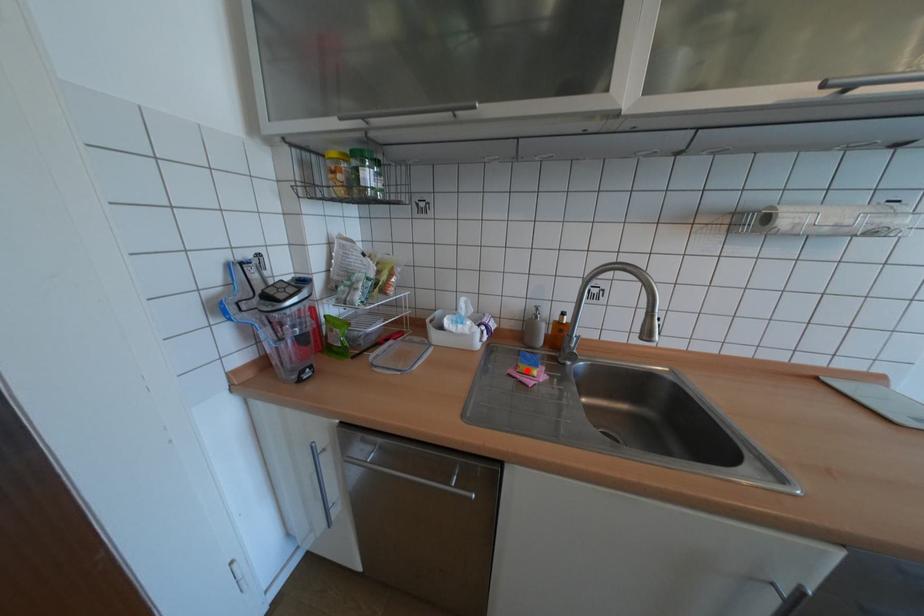
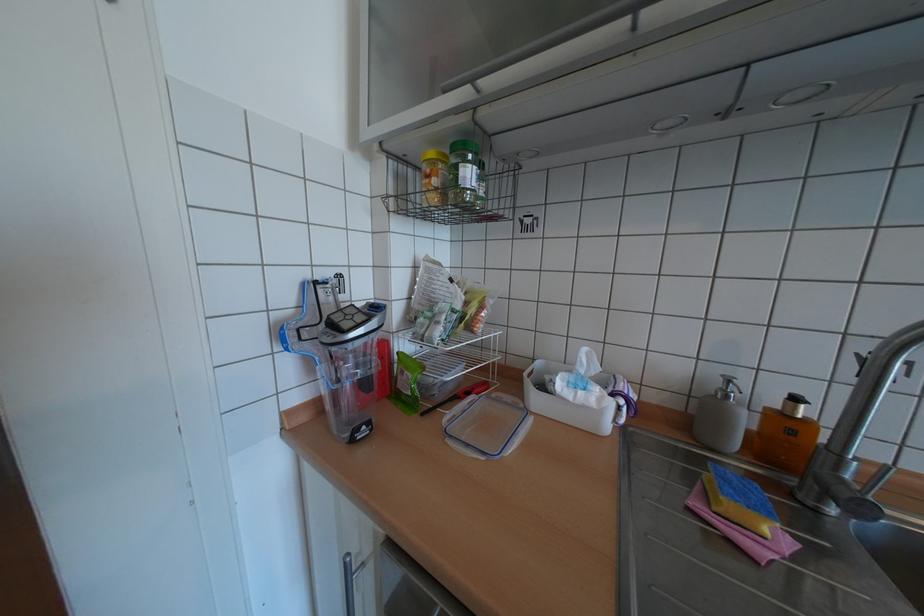
The point at the highlighted location is marked in the first image. Where is the corresponding point in the second image?

(723, 508)